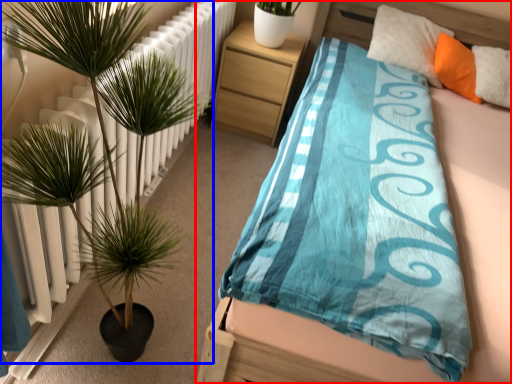
Question: Which object is further to the camera taking this photo, bed (highlighted by a red box) or houseplant (highlighted by a blue box)?

Choices:
 (A) bed
 (B) houseplant

Answer: (A)